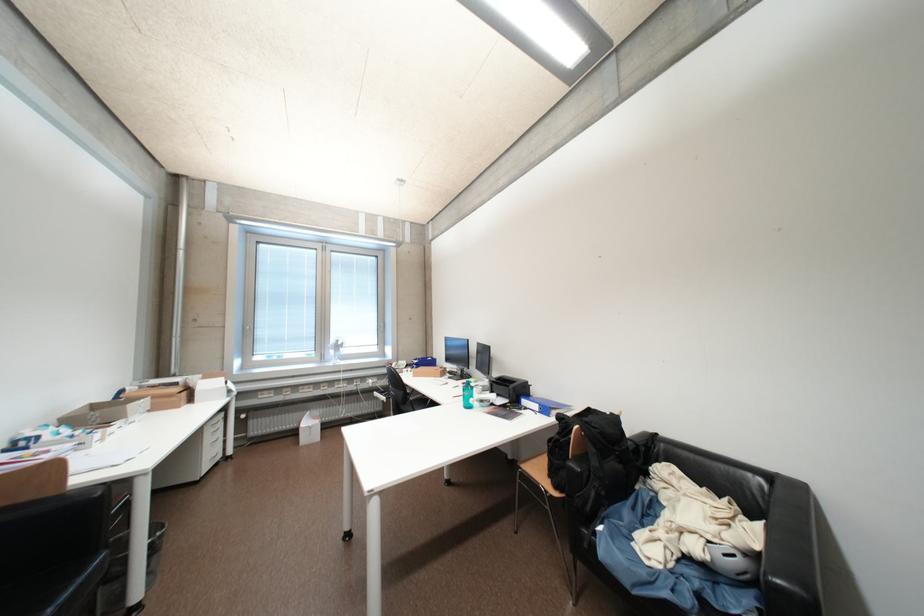
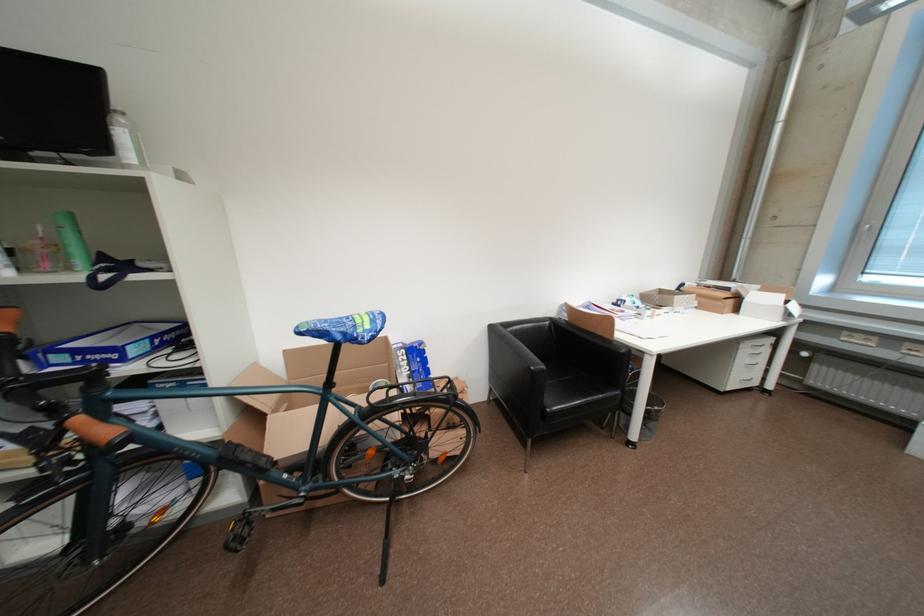
How did the camera likely rotate?

The camera's rotation is toward left-down.